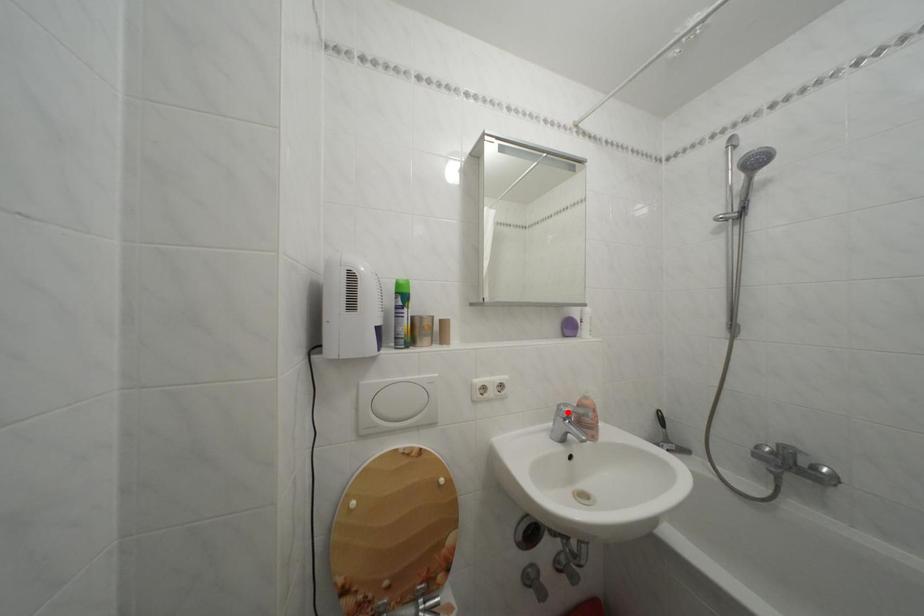
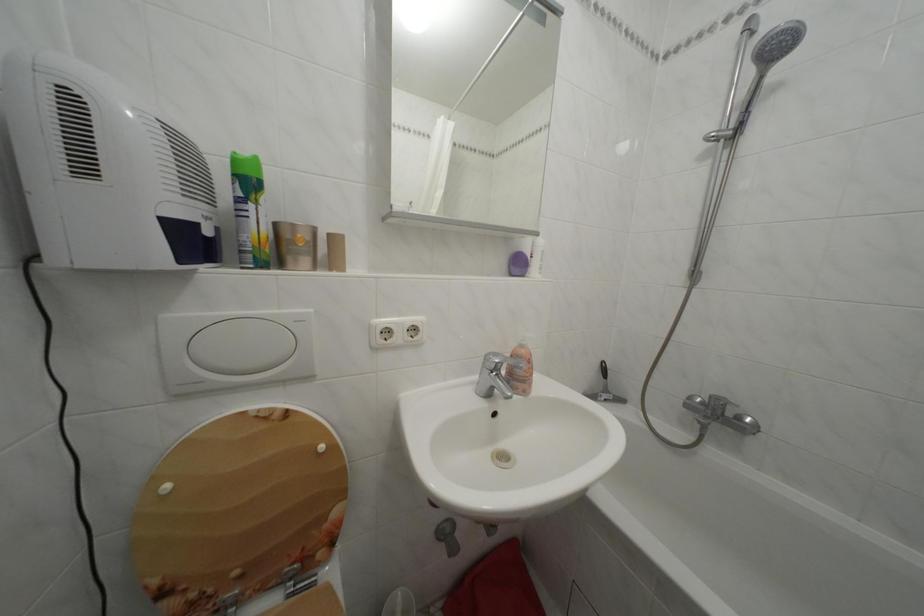
The point at the highlighted location is marked in the first image. Where is the corresponding point in the second image?

(495, 362)